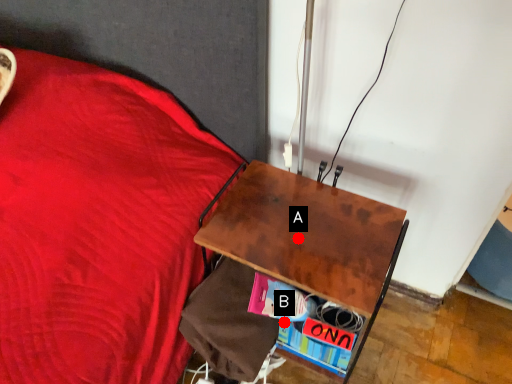
Question: Two points are circled on the image, labeled by A and B beside each circle. Which point is further to the camera?

Choices:
 (A) A is further
 (B) B is further

Answer: (B)